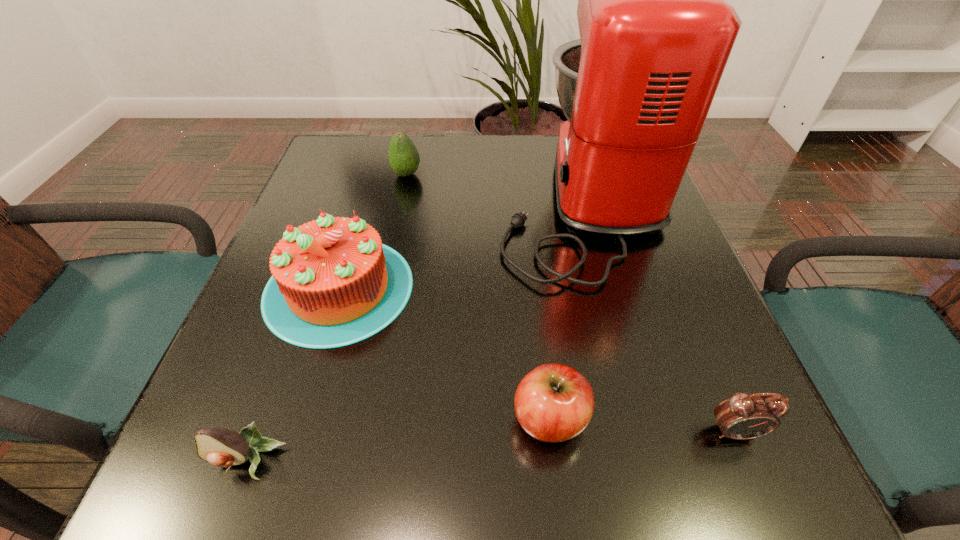
You are a GUI agent. You are given a task and a screenshot of the screen. Output one action in this format:
    pyautogui.click(x=<x>, y=<y>)
    Task: Click on the kitchen mixer situated at the right edge
    
    Given the screenshot: What is the action you would take?
    pyautogui.click(x=655, y=32)

Locate an element on the screen. Image resolution: width=960 pixels, height=540 pixels. alarm clock located in the right edge section of the desktop is located at coordinates click(743, 416).

The image size is (960, 540). Identify the location of object that is positioned at the near left corner. (220, 447).

This screenshot has width=960, height=540. Find the location of `object present at the far right corner`. object present at the far right corner is located at coordinates (655, 32).

The image size is (960, 540). I want to click on object that is at the near right corner, so [x=743, y=416].

Locate an element on the screen. blank space at the far edge is located at coordinates (486, 136).

In the image, there is a desktop. Where is `free region at the left edge`? free region at the left edge is located at coordinates (267, 263).

This screenshot has width=960, height=540. Find the location of `vacant space at the right edge of the desktop`. vacant space at the right edge of the desktop is located at coordinates (650, 258).

At what (x,y) coordinates should I click in order to perform the action: click on vacant space at the far left corner. Please return your answer as a coordinate pair (x, y). Looking at the image, I should click on (333, 134).

This screenshot has width=960, height=540. I want to click on vacant region at the near left corner, so click(x=174, y=477).